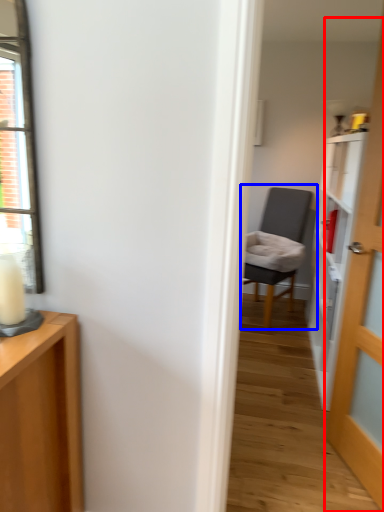
Question: Which object appears farthest to the camera in this image, door (highlighted by a red box) or chair (highlighted by a blue box)?

Choices:
 (A) door
 (B) chair

Answer: (B)